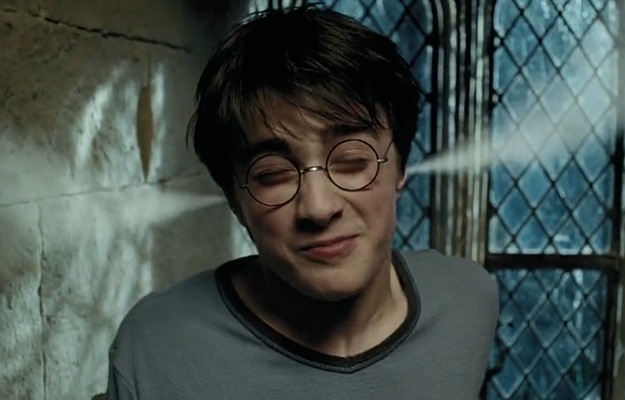
This screenshot has width=625, height=400. Find the location of `window`. window is located at coordinates (572, 202).